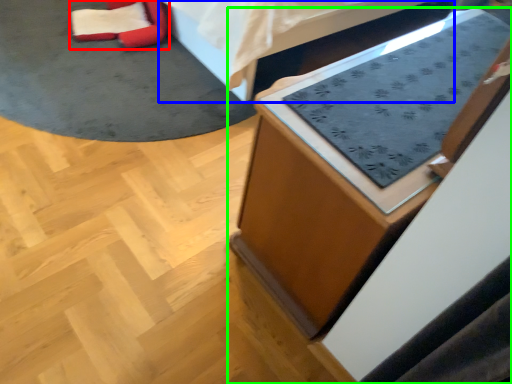
Question: Estimate the real-world distances between objects in this image. Which object is closer to bean bag chair (highlighted by a red box), furniture (highlighted by a blue box) or furniture (highlighted by a green box)?

Choices:
 (A) furniture
 (B) furniture

Answer: (A)